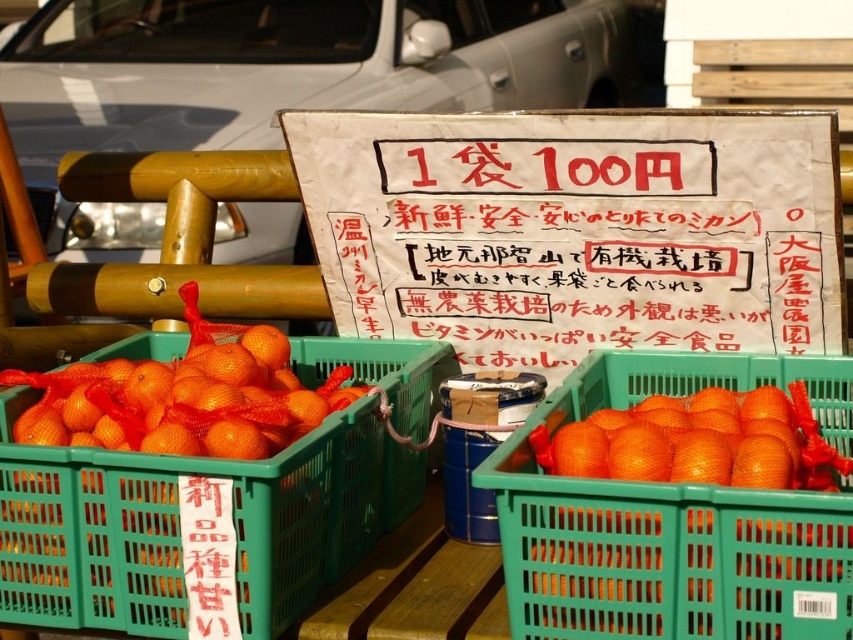
You are a customer at the market stall and want to buy the taller item between the orange mesh bag at center and the orange mesh basket at center. Which one should you choose?

The orange mesh bag at center is taller than the orange mesh basket at center, so you should choose the orange mesh bag at center.

You are a customer at the market stall and want to buy an orange mesh bag at center and an orange mesh basket at center. The vendor tells you that the larger one costs twice as much as the smaller one. According to the sign, how much would you pay for both?

The orange mesh bag at center is larger than the orange mesh basket at center. Since the larger one costs twice as much as the smaller one, and the sign states 1 bag is 100 yen, the total cost would be 100 yen plus 200 yen, totaling 300 yen.